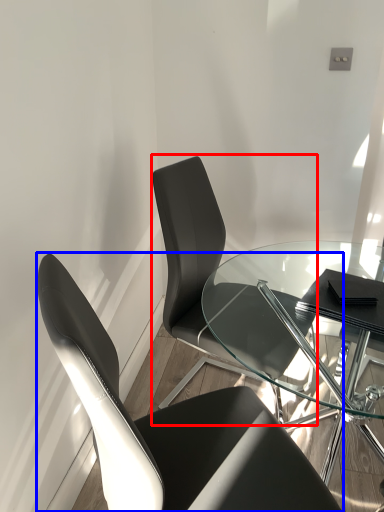
Question: Which of the following is the farthest to the observer, chair (highlighted by a red box) or chair (highlighted by a blue box)?

Choices:
 (A) chair
 (B) chair

Answer: (A)